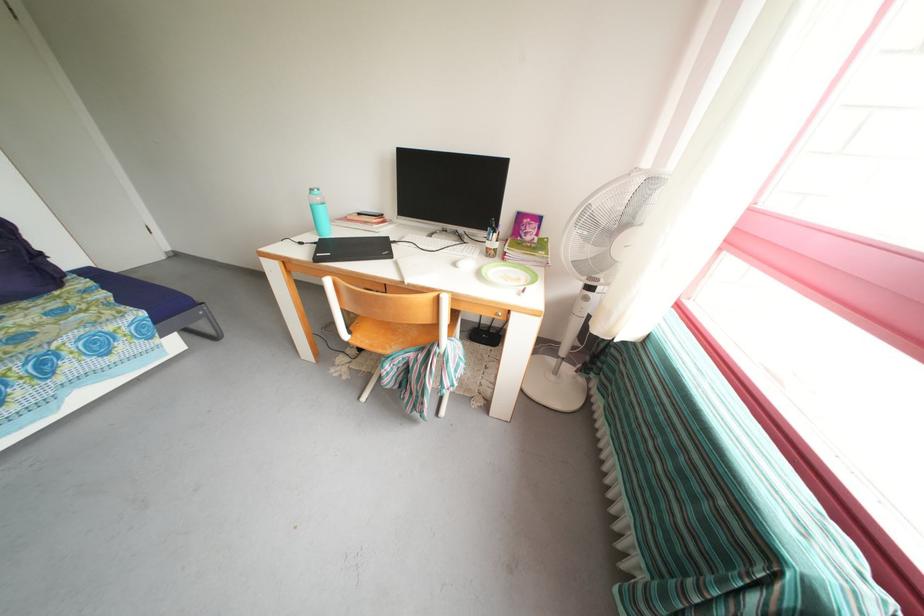
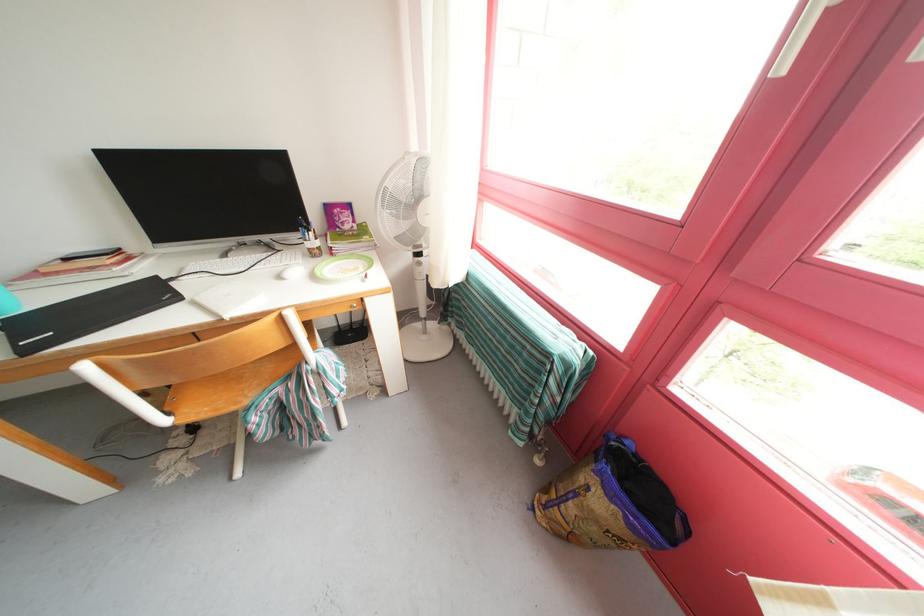
Locate, in the second image, the point that corresponds to (x=395, y=244) in the first image.

(164, 283)